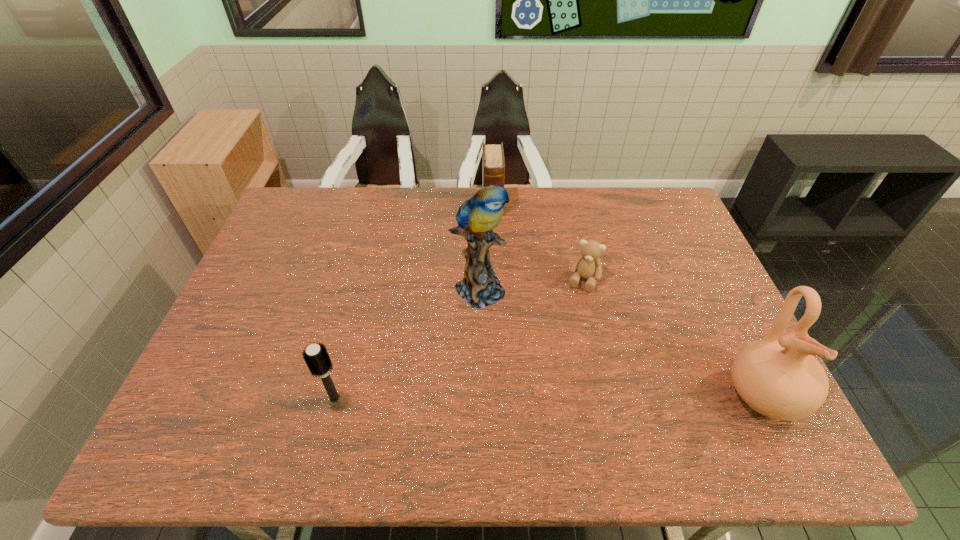
Image resolution: width=960 pixels, height=540 pixels. Find the location of `free space located 0.360m on the face of the parrot`. free space located 0.360m on the face of the parrot is located at coordinates (600, 394).

Identify the location of free region located on the front-facing side of the fourth object from left to right. The image size is (960, 540). (564, 338).

The height and width of the screenshot is (540, 960). I want to click on free space located 0.380m on the front-facing side of the fourth object from left to right, so click(539, 406).

Locate an element on the screen. The width and height of the screenshot is (960, 540). vacant region located on the front-facing side of the fourth object from left to right is located at coordinates (575, 305).

This screenshot has width=960, height=540. Find the location of `vacant space located 0.110m on the spine side of the diary`. vacant space located 0.110m on the spine side of the diary is located at coordinates (494, 240).

In order to click on vacant area situated on the spine side of the diary in this screenshot , I will do `click(495, 264)`.

At what (x,y) coordinates should I click in order to perform the action: click on free region located 0.320m on the spine side of the diary. Please return your answer as a coordinate pair (x, y). The image size is (960, 540). Looking at the image, I should click on (496, 288).

Identify the location of object present at the far edge. This screenshot has width=960, height=540. tap(493, 173).

Find the location of a particular element. The height and width of the screenshot is (540, 960). hairbrush situated at the near edge is located at coordinates 316,356.

You are a GUI agent. You are given a task and a screenshot of the screen. Output one action in this format:
    pyautogui.click(x=<x>, y=<y>)
    Task: Click on the pottery that is at the near edge
    The width and height of the screenshot is (960, 540).
    Given the screenshot: What is the action you would take?
    pyautogui.click(x=777, y=376)